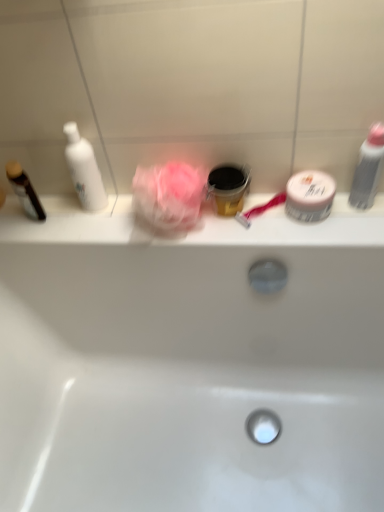
Question: Are pink fabric rose at center and black plastic cup at center, which is counted as the second toiletry, starting from the left, far apart?

Choices:
 (A) yes
 (B) no

Answer: (B)

Question: Is pink fabric rose at center aimed at black plastic cup at center, arranged as the third toiletry when viewed from the right?

Choices:
 (A) no
 (B) yes

Answer: (A)

Question: From the image's perspective, is pink fabric rose at center on black plastic cup at center, arranged as the third toiletry when viewed from the right?

Choices:
 (A) yes
 (B) no

Answer: (B)

Question: Is pink fabric rose at center behind black plastic cup at center, which is counted as the second toiletry, starting from the left?

Choices:
 (A) no
 (B) yes

Answer: (A)

Question: From a real-world perspective, is pink fabric rose at center beneath black plastic cup at center, arranged as the third toiletry when viewed from the right?

Choices:
 (A) no
 (B) yes

Answer: (A)

Question: Considering the relative positions of pink fabric rose at center and black plastic cup at center, arranged as the third toiletry when viewed from the right, in the image provided, is pink fabric rose at center to the right of black plastic cup at center, arranged as the third toiletry when viewed from the right, from the viewer's perspective?

Choices:
 (A) no
 (B) yes

Answer: (A)

Question: Considering the relative sizes of black plastic cup at center, arranged as the third toiletry when viewed from the right, and gray matte bottle at right, the 1th toiletry in the right-to-left sequence, in the image provided, is black plastic cup at center, arranged as the third toiletry when viewed from the right, bigger than gray matte bottle at right, the 1th toiletry in the right-to-left sequence,?

Choices:
 (A) yes
 (B) no

Answer: (A)

Question: Is black plastic cup at center, which is counted as the second toiletry, starting from the left, facing away from gray matte bottle at right, the 1th toiletry in the right-to-left sequence?

Choices:
 (A) yes
 (B) no

Answer: (B)

Question: Is black plastic cup at center, arranged as the third toiletry when viewed from the right, at the right side of gray matte bottle at right, the 4th toiletry positioned from the left?

Choices:
 (A) no
 (B) yes

Answer: (A)

Question: Considering the relative sizes of black plastic cup at center, which is counted as the second toiletry, starting from the left, and gray matte bottle at right, the 1th toiletry in the right-to-left sequence, in the image provided, is black plastic cup at center, which is counted as the second toiletry, starting from the left, shorter than gray matte bottle at right, the 1th toiletry in the right-to-left sequence,?

Choices:
 (A) no
 (B) yes

Answer: (B)

Question: Considering the relative positions of black plastic cup at center, arranged as the third toiletry when viewed from the right, and gray matte bottle at right, the 4th toiletry positioned from the left, in the image provided, is black plastic cup at center, arranged as the third toiletry when viewed from the right, behind gray matte bottle at right, the 4th toiletry positioned from the left,?

Choices:
 (A) no
 (B) yes

Answer: (B)

Question: From a real-world perspective, is black plastic cup at center, which is counted as the second toiletry, starting from the left, physically below gray matte bottle at right, the 1th toiletry in the right-to-left sequence?

Choices:
 (A) yes
 (B) no

Answer: (A)

Question: Is white glossy bathtub at center bigger than black plastic cup at center, which is counted as the second toiletry, starting from the left?

Choices:
 (A) yes
 (B) no

Answer: (A)